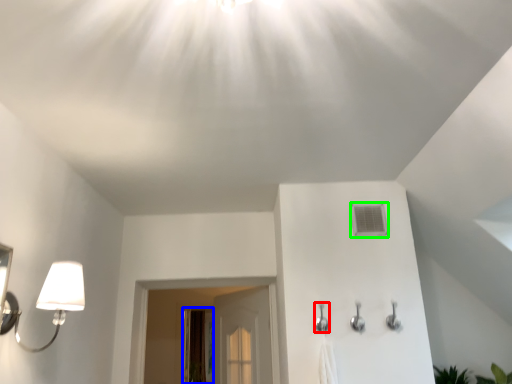
Question: Which object is the farthest from shower (highlighted by a red box)? Choose among these: screen door (highlighted by a blue box) or air conditioner (highlighted by a green box).

Choices:
 (A) screen door
 (B) air conditioner

Answer: (A)